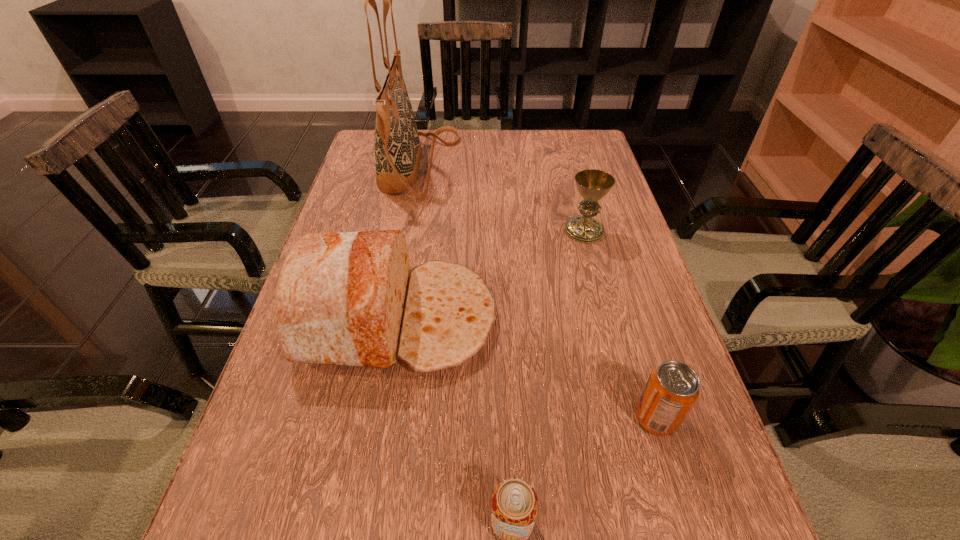
Where is `vacant point located 0.160m on the back of the chalice`? Image resolution: width=960 pixels, height=540 pixels. vacant point located 0.160m on the back of the chalice is located at coordinates (571, 184).

Where is `vacant area located 0.170m on the left of the second shortest object`? vacant area located 0.170m on the left of the second shortest object is located at coordinates (533, 418).

The image size is (960, 540). What are the coordinates of `object located at the far edge` in the screenshot? It's located at (398, 151).

The image size is (960, 540). In order to click on handbag that is positioned at the left edge in this screenshot , I will do `click(398, 151)`.

Identify the location of bread that is at the left edge. This screenshot has width=960, height=540. (348, 298).

Find the location of a particular element. The height and width of the screenshot is (540, 960). chalice that is at the right edge is located at coordinates (593, 185).

Locate an element on the screen. soda can located at the right edge is located at coordinates (672, 389).

Where is `object that is at the far left corner`? object that is at the far left corner is located at coordinates (398, 151).

In the image, there is a desktop. Where is `vacant space at the far edge`? The width and height of the screenshot is (960, 540). vacant space at the far edge is located at coordinates (517, 140).

Where is `blank space at the left edge`? This screenshot has height=540, width=960. blank space at the left edge is located at coordinates (333, 232).